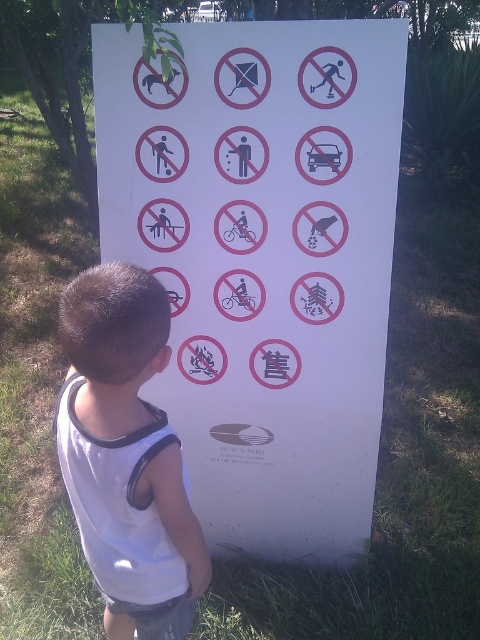
You are a parent trying to teach your child about the rules in the park. You see the white paper sign at center and the white fabric shirt at center. Which object is located to the right of the other?

The white paper sign at center is positioned on the right side of white fabric shirt at center, so the white paper sign at center is to the right of the white fabric shirt at center.